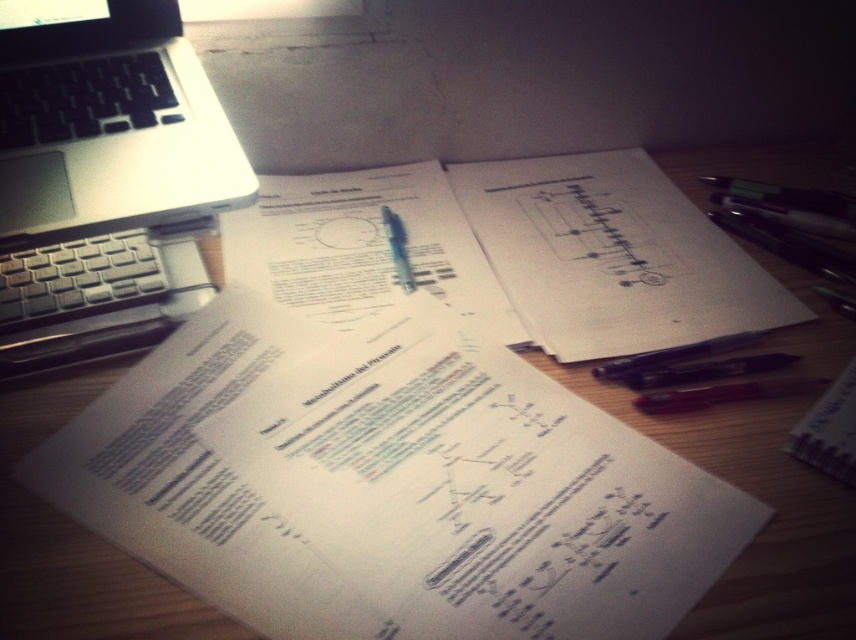
Question: Which is farther from the silver metallic laptop at upper left?

Choices:
 (A) white paper at center
 (B) red matte pen at lower right

Answer: (B)

Question: Which point is closer to the camera?

Choices:
 (A) (177, 164)
 (B) (705, 388)

Answer: (A)

Question: Is silver metallic laptop at upper left to the left of red matte pen at lower right from the viewer's perspective?

Choices:
 (A) yes
 (B) no

Answer: (A)

Question: Is silver metallic laptop at upper left above white paper at center?

Choices:
 (A) no
 (B) yes

Answer: (B)

Question: Which of these objects is positioned farthest from the white paper at center?

Choices:
 (A) silver metallic laptop at upper left
 (B) red matte pen at lower right

Answer: (A)

Question: Where is white paper at center located in relation to red matte pen at lower right in the image?

Choices:
 (A) right
 (B) left

Answer: (B)